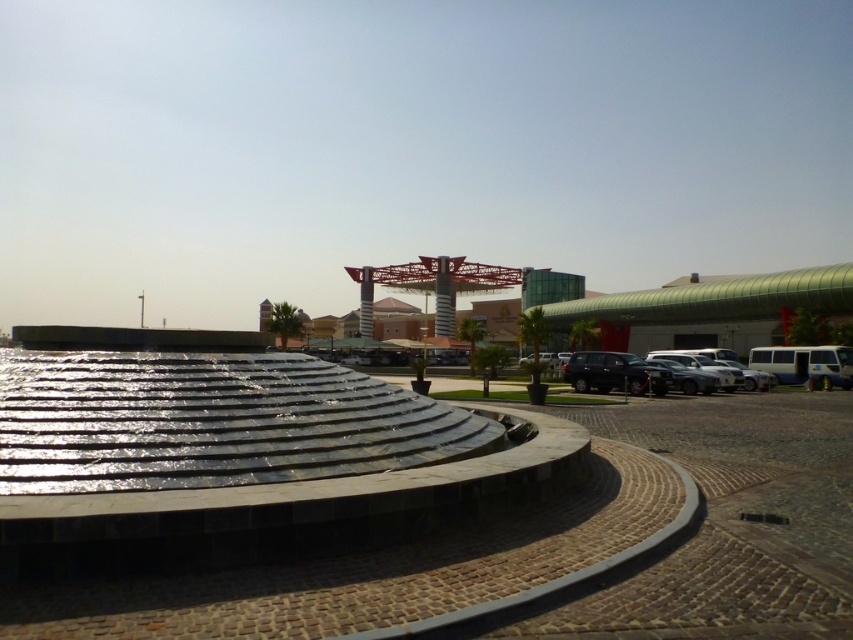
Is the position of metallic glass mall at center less distant than that of shiny black suv at center?

Answer: No, metallic glass mall at center is behind shiny black suv at center.

Does point (776, 298) come behind point (625, 376)?

Yes, it is behind point (625, 376).

Find the location of a particular element. metallic glass mall at center is located at coordinates (712, 301).